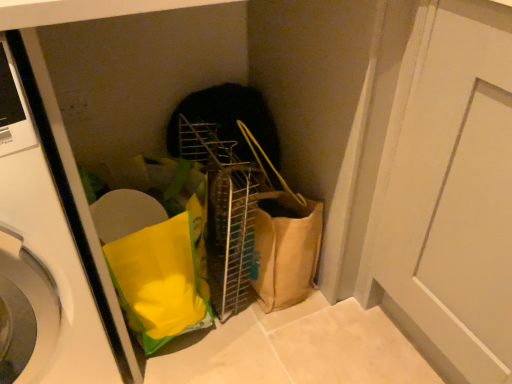
Question: Is point coord(438,192) positioned closer to the camera than point coord(108,375)?

Choices:
 (A) farther
 (B) closer

Answer: (B)

Question: Based on their sizes in the image, would you say white matte door at center-right is bigger or smaller than white glossy washing machine at left?

Choices:
 (A) big
 (B) small

Answer: (B)

Question: Is white matte door at center-right taller or shorter than white glossy washing machine at left?

Choices:
 (A) short
 (B) tall

Answer: (A)

Question: Considering their positions, is white glossy washing machine at left located in front of or behind white matte door at center-right?

Choices:
 (A) front
 (B) behind

Answer: (A)

Question: Based on their positions, is white glossy washing machine at left located to the left or right of white matte door at center-right?

Choices:
 (A) left
 (B) right

Answer: (A)

Question: From their relative heights in the image, would you say white glossy washing machine at left is taller or shorter than white matte door at center-right?

Choices:
 (A) short
 (B) tall

Answer: (B)

Question: Does point (55, 203) appear closer or farther from the camera than point (489, 117)?

Choices:
 (A) farther
 (B) closer

Answer: (B)